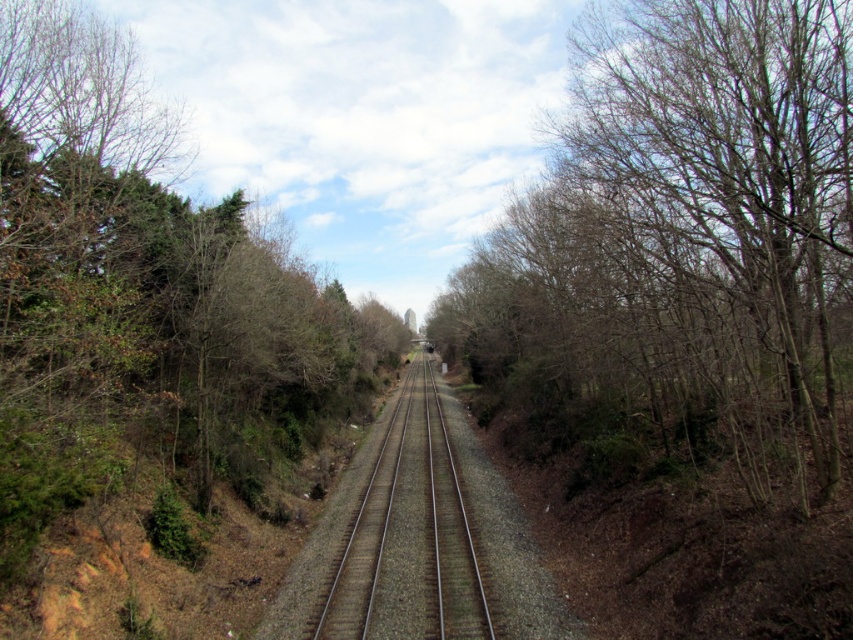
Is bare branches at center positioned at the back of metal train track at center?

No, it is in front of metal train track at center.

Which is more to the right, bare branches at center or metal train track at center?

Positioned to the right is bare branches at center.

What do you see at coordinates (683, 241) in the screenshot? The image size is (853, 640). I see `bare branches at center` at bounding box center [683, 241].

At what (x,y) coordinates should I click in order to perform the action: click on bare branches at center. Please return your answer as a coordinate pair (x, y). The height and width of the screenshot is (640, 853). Looking at the image, I should click on (683, 241).